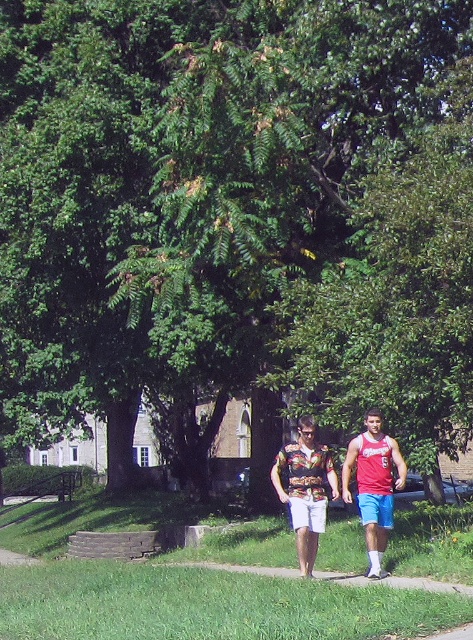
Question: Estimate the real-world distances between objects in this image. Which object is closer to the floral fabric shirt at center?

Choices:
 (A) hawaiian print shirt at center
 (B) red fabric tank top at center

Answer: (B)

Question: Is floral fabric shirt at center positioned in front of hawaiian print shirt at center?

Choices:
 (A) no
 (B) yes

Answer: (B)

Question: Can you confirm if floral fabric shirt at center is positioned below hawaiian print shirt at center?

Choices:
 (A) no
 (B) yes

Answer: (A)

Question: Can you confirm if red fabric tank top at center is positioned to the right of hawaiian print shirt at center?

Choices:
 (A) yes
 (B) no

Answer: (A)

Question: Which object appears closest to the camera in this image?

Choices:
 (A) hawaiian print shirt at center
 (B) floral fabric shirt at center

Answer: (B)

Question: Which object is farther from the camera taking this photo?

Choices:
 (A) hawaiian print shirt at center
 (B) red fabric tank top at center

Answer: (A)